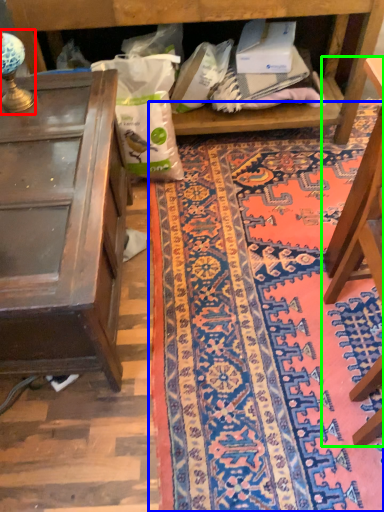
Question: Estimate the real-world distances between objects in this image. Which object is farther from lamp (highlighted by a red box), mat (highlighted by a blue box) or furniture (highlighted by a green box)?

Choices:
 (A) mat
 (B) furniture

Answer: (B)